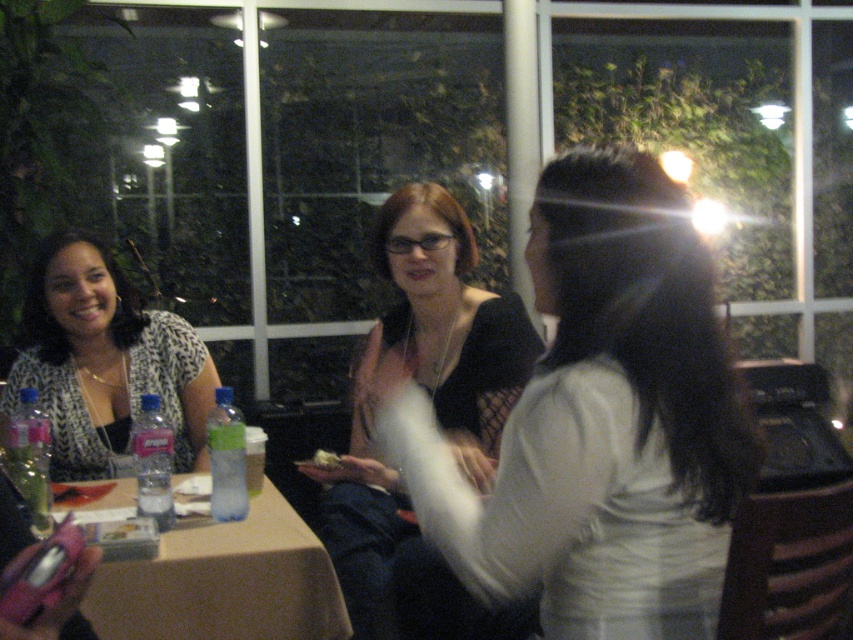
Based on the photo, you are a fashion designer observing the women in the scene. You notice two items labeled as the matte black shirt at center and the matte black top at center. Which one is narrower?

The matte black shirt at center is narrower than the matte black top at center because its width is less than the latter.

You are a server at the restaurant and need to deliver a drink to the person wearing the matte black shirt at center. The tray you are holding is 1 meter wide. Can you walk between the table and the nearest wall without dropping the tray?

The distance between the table and the nearest wall is 1.06 meters, so yes, the tray can be carried safely as it is slightly wider than the space available.